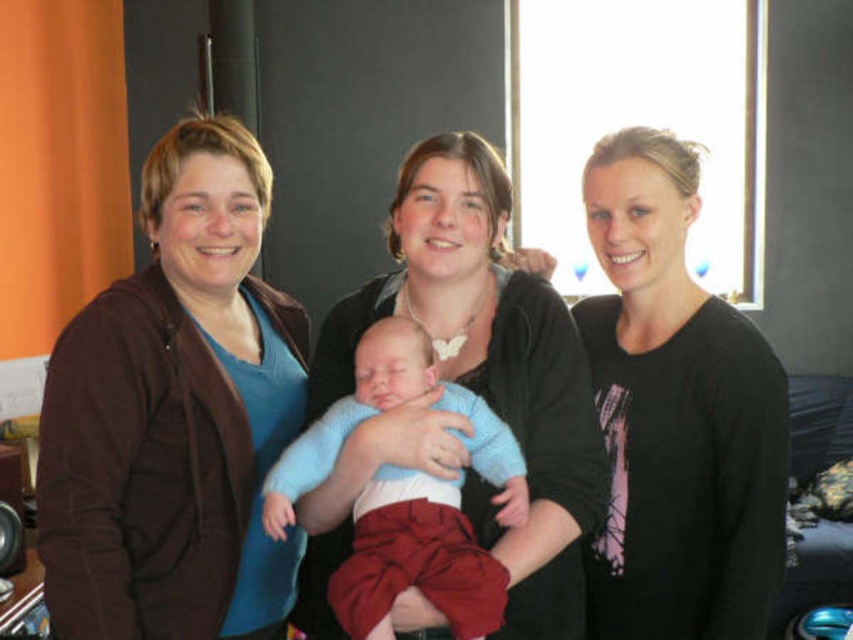
Question: Can you confirm if brown fleece jacket at left is bigger than black matte shirt at center?

Choices:
 (A) yes
 (B) no

Answer: (A)

Question: Based on their relative distances, which object is nearer to the knitted blue sweater at center?

Choices:
 (A) black matte shirt at center
 (B) matte black sweater at center
 (C) brown fleece jacket at left

Answer: (B)

Question: Is matte black sweater at center to the right of knitted blue sweater at center from the viewer's perspective?

Choices:
 (A) yes
 (B) no

Answer: (A)

Question: Which point is farther to the camera?

Choices:
 (A) brown fleece jacket at left
 (B) knitted blue sweater at center
 (C) black matte shirt at center

Answer: (C)

Question: Which object is the farthest from the black matte shirt at center?

Choices:
 (A) matte black sweater at center
 (B) knitted blue sweater at center

Answer: (B)

Question: Is brown fleece jacket at left below knitted blue sweater at center?

Choices:
 (A) no
 (B) yes

Answer: (A)